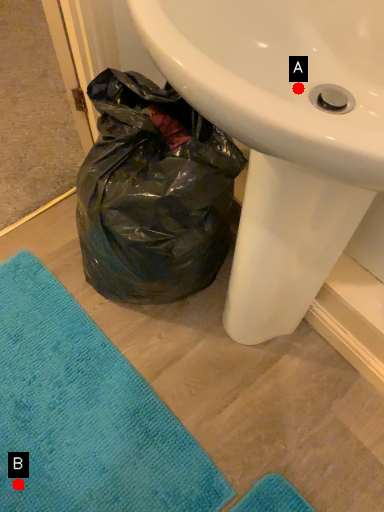
Question: Two points are circled on the image, labeled by A and B beside each circle. Which point appears closest to the camera in this image?

Choices:
 (A) A is closer
 (B) B is closer

Answer: (A)